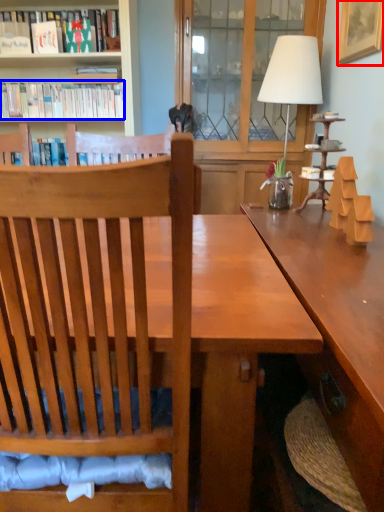
Question: Which object is further to the camera taking this photo, picture frame (highlighted by a red box) or book (highlighted by a blue box)?

Choices:
 (A) picture frame
 (B) book

Answer: (B)